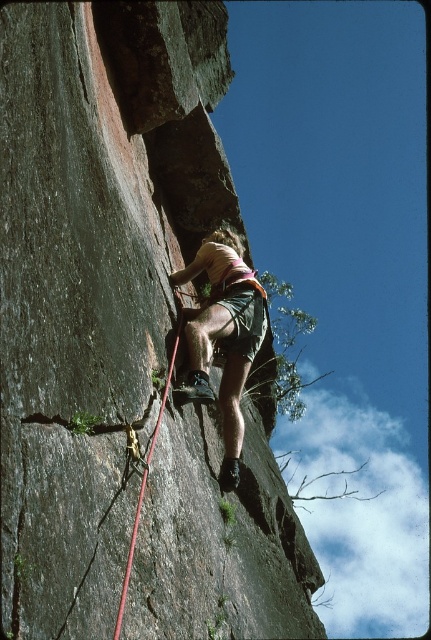
Question: Among these objects, which one is farthest from the camera?

Choices:
 (A) matte pink shorts at center
 (B) red nylon rope at center

Answer: (A)

Question: Where is matte pink shorts at center located in relation to red nylon rope at center in the image?

Choices:
 (A) right
 (B) left

Answer: (A)

Question: Is matte pink shorts at center below red nylon rope at center?

Choices:
 (A) yes
 (B) no

Answer: (B)

Question: Which point is farther to the camera?

Choices:
 (A) matte pink shorts at center
 (B) red nylon rope at center

Answer: (A)

Question: Does matte pink shorts at center have a lesser width compared to red nylon rope at center?

Choices:
 (A) yes
 (B) no

Answer: (B)

Question: Which of the following is the farthest from the observer?

Choices:
 (A) (196, 368)
 (B) (153, 445)

Answer: (A)